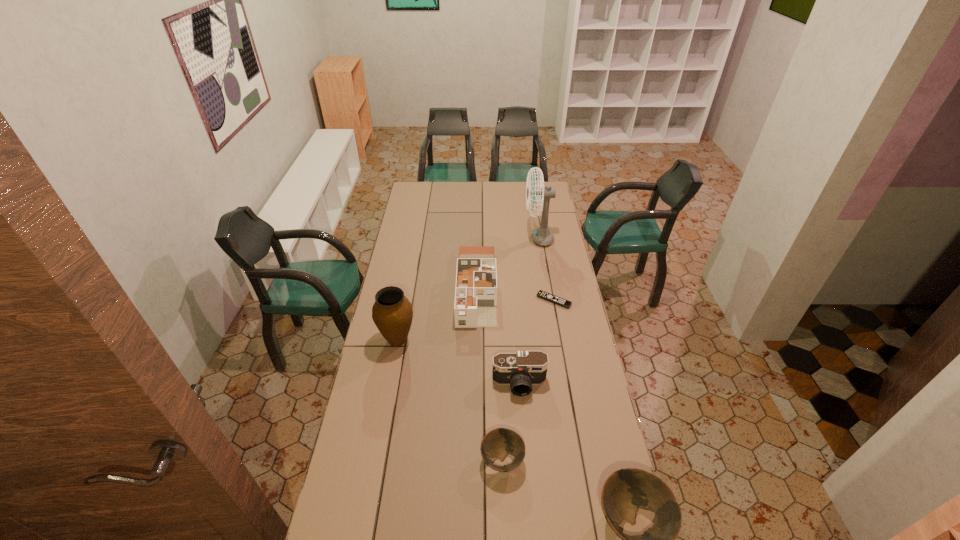
Where is `vacant region at the far edge of the desktop`? Image resolution: width=960 pixels, height=540 pixels. vacant region at the far edge of the desktop is located at coordinates [x=523, y=199].

At what (x,y) coordinates should I click in order to perform the action: click on blank area at the near edge. Please return your answer as a coordinate pair (x, y). This screenshot has width=960, height=540. Looking at the image, I should click on (397, 515).

Find the location of `vacant region at the left edge`. vacant region at the left edge is located at coordinates (405, 249).

In the image, there is a desktop. What are the coordinates of `vacant space at the right edge` in the screenshot? It's located at (548, 278).

In order to click on free space between the urn and the sixth tallest object in this screenshot , I will do `click(450, 400)`.

You are a GUI agent. You are given a task and a screenshot of the screen. Output one action in this format:
    pyautogui.click(x=<x>, y=<y>)
    Task: Click on the vacant area that lies between the dollhouse and the second nearest object
    The height and width of the screenshot is (540, 960).
    Given the screenshot: What is the action you would take?
    pyautogui.click(x=490, y=374)

Find the location of a particular element. free spot between the left bowl and the urn is located at coordinates (450, 400).

Locate an element on the screen. free space between the leftmost object and the dollhouse is located at coordinates (437, 314).

Where is `vacant point located between the shortest object and the tallest object`? The height and width of the screenshot is (540, 960). vacant point located between the shortest object and the tallest object is located at coordinates (546, 269).

Choose which object is the fourth nearest neighbor to the shortest object. Please provide its 2D coordinates. Your answer should be formatted as a tuple, i.e. [(x, y)], where the tuple contains the x and y coordinates of a point satisfying the conditions above.

[(392, 313)]